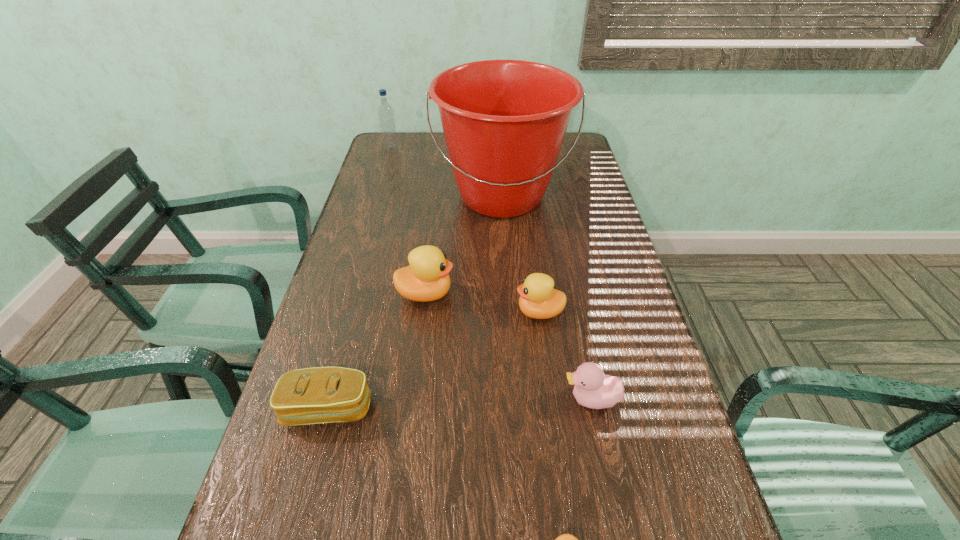
Find the location of a particular element. free spot between the pink duckling and the second smallest yellow duckling is located at coordinates (565, 355).

Locate an element on the screen. The image size is (960, 540). blank region between the second biggest yellow duckling and the water bottle is located at coordinates (466, 230).

Identify the location of object that is the third nearest to the fifth shortest object. The height and width of the screenshot is (540, 960). (316, 395).

Locate which object ranks sixth in proximity to the farthest object. Please provide its 2D coordinates. Your answer should be formatted as a tuple, i.e. [(x, y)], where the tuple contains the x and y coordinates of a point satisfying the conditions above.

[(565, 539)]

The image size is (960, 540). Identify the location of duckling that is the fourth closest one to the clutch bag. point(593,389).

Locate an element on the screen. The image size is (960, 540). duckling that stands as the second closest to the fifth shortest object is located at coordinates (593, 389).

Identify which yellow duckling is the third closest to the red bucket. Please provide its 2D coordinates. Your answer should be formatted as a tuple, i.e. [(x, y)], where the tuple contains the x and y coordinates of a point satisfying the conditions above.

[(565, 539)]

You are a GUI agent. You are given a task and a screenshot of the screen. Output one action in this format:
    pyautogui.click(x=<x>, y=<y>)
    Task: Click on the second closest yellow duckling relative to the red bucket
    
    Given the screenshot: What is the action you would take?
    pyautogui.click(x=538, y=299)